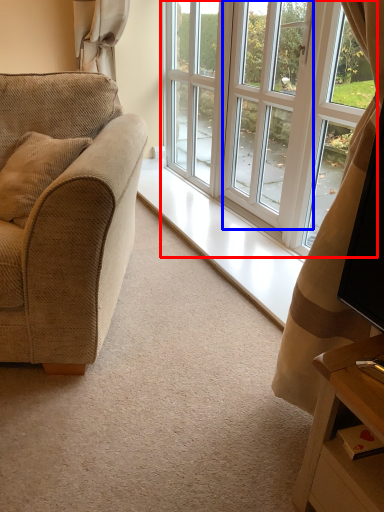
Question: Which point is closer to the camera, window (highlighted by a red box) or screen door (highlighted by a blue box)?

Choices:
 (A) window
 (B) screen door

Answer: (A)